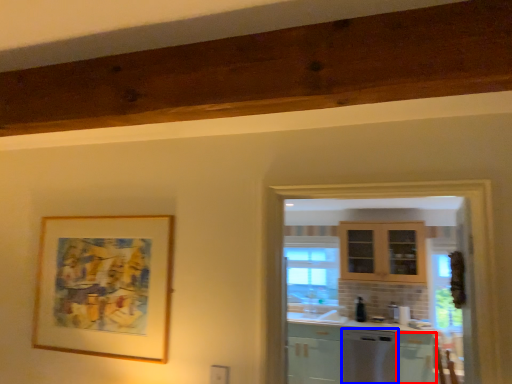
Question: Which point is closer to the camera, cabinetry (highlighted by a red box) or dish washer (highlighted by a blue box)?

Choices:
 (A) cabinetry
 (B) dish washer

Answer: (A)